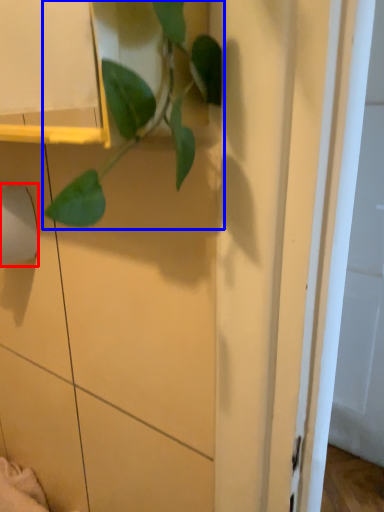
Question: Which object is closer to the camera taking this photo, toilet paper (highlighted by a red box) or houseplant (highlighted by a blue box)?

Choices:
 (A) toilet paper
 (B) houseplant

Answer: (B)